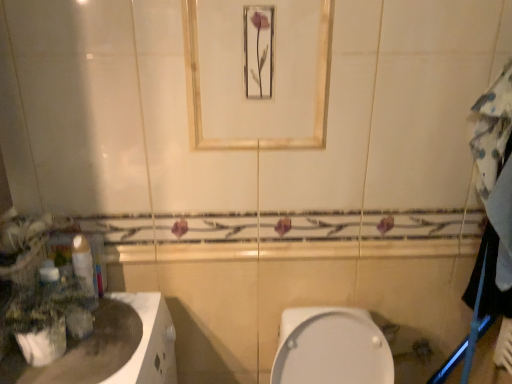
Question: Is white glossy countertop at lower left thinner than matte gold mirror at upper center?

Choices:
 (A) no
 (B) yes

Answer: (A)

Question: Does white glossy countertop at lower left have a lesser height compared to matte gold mirror at upper center?

Choices:
 (A) yes
 (B) no

Answer: (A)

Question: Is white glossy countertop at lower left closer to the viewer compared to matte gold mirror at upper center?

Choices:
 (A) yes
 (B) no

Answer: (A)

Question: From the image's perspective, would you say white glossy countertop at lower left is shown under matte gold mirror at upper center?

Choices:
 (A) yes
 (B) no

Answer: (A)

Question: From a real-world perspective, is white glossy countertop at lower left beneath matte gold mirror at upper center?

Choices:
 (A) yes
 (B) no

Answer: (A)

Question: Visually, is white glossy countertop at lower left positioned to the left or to the right of white glossy toilet paper at left?

Choices:
 (A) left
 (B) right

Answer: (A)

Question: From a real-world perspective, is white glossy countertop at lower left positioned above or below white glossy toilet paper at left?

Choices:
 (A) below
 (B) above

Answer: (A)

Question: Is white glossy countertop at lower left in front of or behind white glossy toilet paper at left in the image?

Choices:
 (A) behind
 (B) front

Answer: (B)

Question: Is point (104, 299) positioned closer to the camera than point (81, 263)?

Choices:
 (A) closer
 (B) farther

Answer: (B)

Question: In the image, is matte gold mirror at upper center on the left side or the right side of white glossy toilet paper at left?

Choices:
 (A) left
 (B) right

Answer: (B)

Question: Is matte gold mirror at upper center bigger or smaller than white glossy toilet paper at left?

Choices:
 (A) big
 (B) small

Answer: (A)

Question: Is matte gold mirror at upper center taller or shorter than white glossy toilet paper at left?

Choices:
 (A) short
 (B) tall

Answer: (B)

Question: Looking at their shapes, would you say matte gold mirror at upper center is wider or thinner than white glossy toilet paper at left?

Choices:
 (A) thin
 (B) wide

Answer: (A)

Question: Is white glossy toilet paper at left situated inside green matte plant at left or outside?

Choices:
 (A) outside
 (B) inside

Answer: (A)

Question: Does point (76, 249) appear closer or farther from the camera than point (58, 357)?

Choices:
 (A) closer
 (B) farther

Answer: (B)